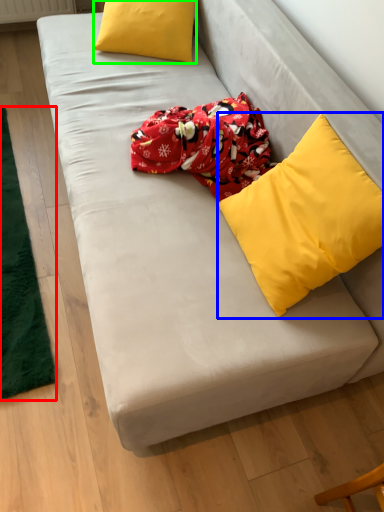
Question: Estimate the real-world distances between objects in this image. Which object is farther from mat (highlighted by a red box), pillow (highlighted by a blue box) or pillow (highlighted by a green box)?

Choices:
 (A) pillow
 (B) pillow

Answer: (A)